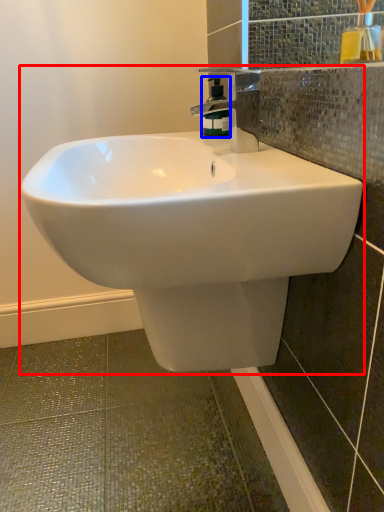
Question: Which object appears farthest to the camera in this image, sink (highlighted by a red box) or soap dispenser (highlighted by a blue box)?

Choices:
 (A) sink
 (B) soap dispenser

Answer: (B)